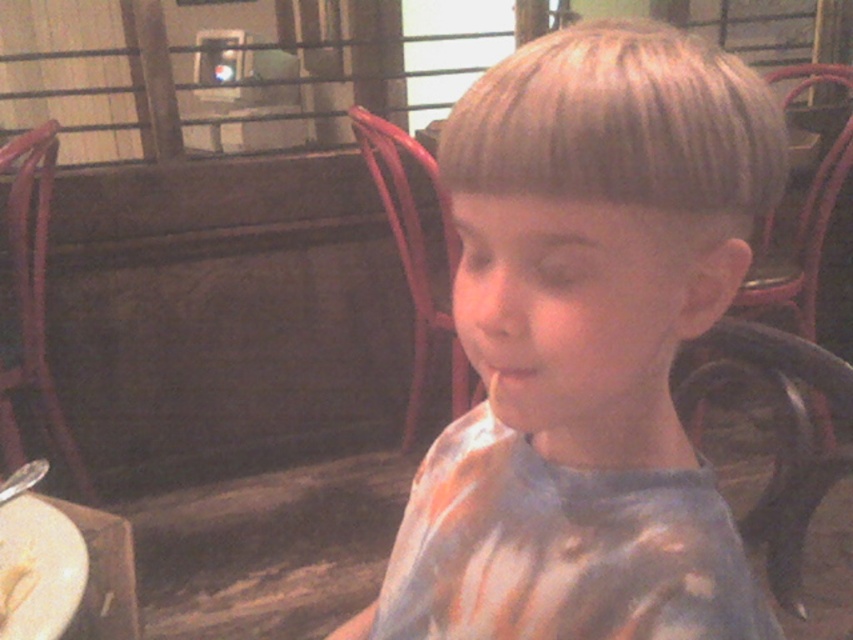
Who is higher up, white matte plate at lower left or white creamy food at lower left?

white matte plate at lower left is above.

The height and width of the screenshot is (640, 853). In order to click on white matte plate at lower left in this screenshot , I will do `click(42, 566)`.

Which is more to the left, light blue tie-dye shirt at center or white matte plate at lower left?

white matte plate at lower left is more to the left.

Does light blue tie-dye shirt at center have a larger size compared to white matte plate at lower left?

Yes.

Does point (479, 556) come farther from viewer compared to point (28, 522)?

That is False.

This screenshot has width=853, height=640. What are the coordinates of `light blue tie-dye shirt at center` in the screenshot? It's located at (587, 346).

Is light blue tie-dye shirt at center taller than white creamy food at lower left?

Yes.

Is point (601, 632) closer to viewer compared to point (33, 586)?

Yes, point (601, 632) is in front of point (33, 586).

Find the location of `light blue tie-dye shirt at center`. light blue tie-dye shirt at center is located at coordinates (587, 346).